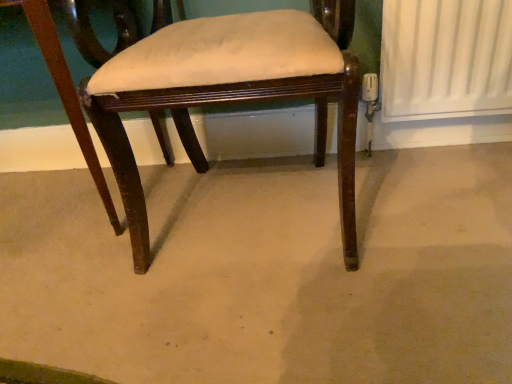
You are a GUI agent. You are given a task and a screenshot of the screen. Output one action in this format:
    pyautogui.click(x=<x>, y=<y>)
    Task: Click on the vacant space to the right of mahogany wood chair at center
    The width and height of the screenshot is (512, 384).
    Given the screenshot: What is the action you would take?
    pyautogui.click(x=424, y=201)